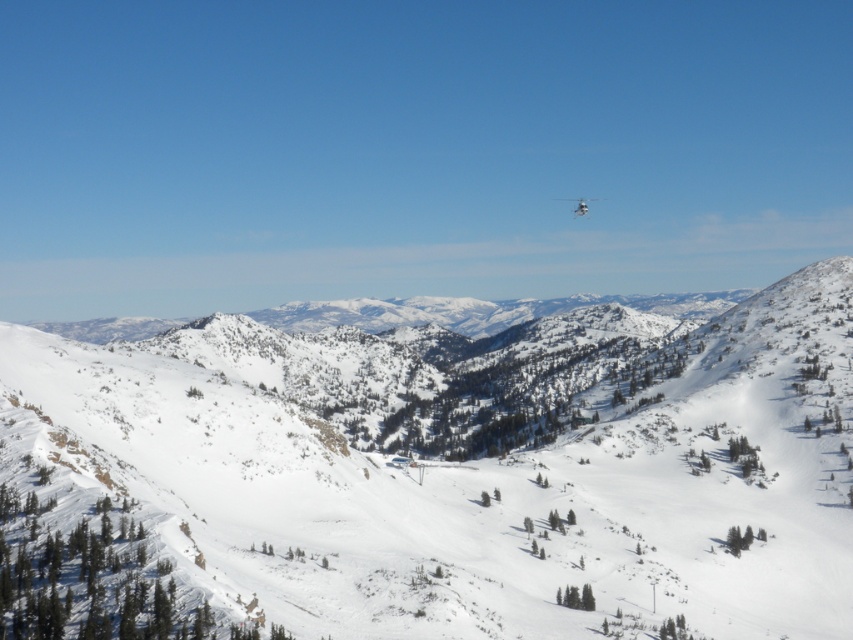
Question: Among these points, which one is farthest from the camera?

Choices:
 (A) (579, 202)
 (B) (169, 604)

Answer: (A)

Question: From the image, what is the correct spatial relationship of white snow-covered mountain at center in relation to white matte helicopter at upper center?

Choices:
 (A) left
 (B) right

Answer: (A)

Question: Is white snow-covered mountain at center behind white matte helicopter at upper center?

Choices:
 (A) no
 (B) yes

Answer: (A)

Question: Which object appears farthest from the camera in this image?

Choices:
 (A) white matte helicopter at upper center
 (B) white snow-covered mountain at center

Answer: (A)

Question: Is white snow-covered mountain at center smaller than white matte helicopter at upper center?

Choices:
 (A) yes
 (B) no

Answer: (B)